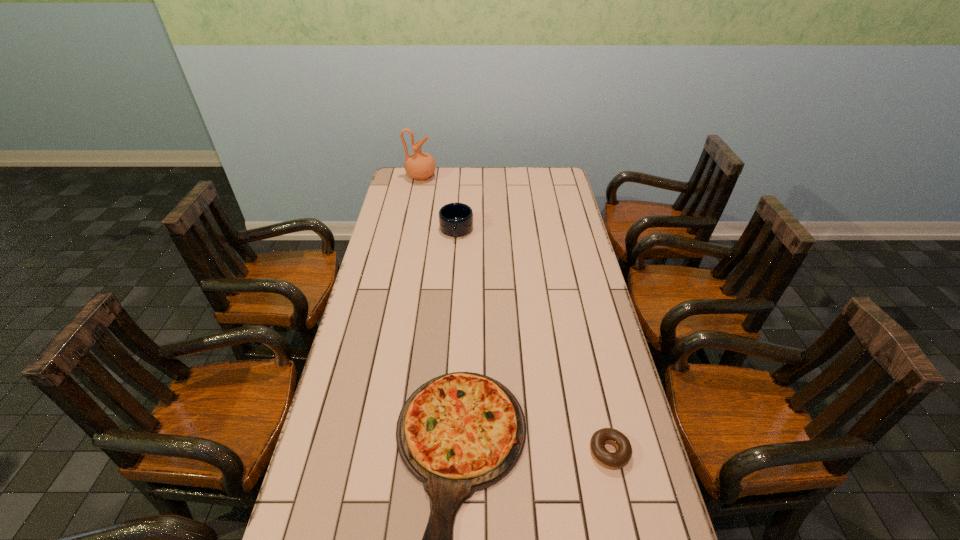
Find the location of a particular element. The image size is (960, 540). pottery is located at coordinates (420, 165).

Image resolution: width=960 pixels, height=540 pixels. What are the coordinates of `the farthest object` in the screenshot? It's located at (420, 165).

Find the location of a particular element. the second tallest object is located at coordinates (455, 219).

The width and height of the screenshot is (960, 540). I want to click on the second farthest object, so click(x=455, y=219).

Find the location of a particular element. The height and width of the screenshot is (540, 960). doughnut is located at coordinates (618, 459).

The height and width of the screenshot is (540, 960). In order to click on the rightmost object in this screenshot , I will do `click(618, 459)`.

This screenshot has height=540, width=960. Find the location of `free space located on the spout of the farthest object`. free space located on the spout of the farthest object is located at coordinates (507, 177).

This screenshot has height=540, width=960. Find the location of `free spot located with the handle on the side of the third shortest object`. free spot located with the handle on the side of the third shortest object is located at coordinates (452, 288).

Image resolution: width=960 pixels, height=540 pixels. Identify the location of free space located 0.210m on the back of the doughnut. (590, 368).

I want to click on object present at the far edge, so click(x=420, y=165).